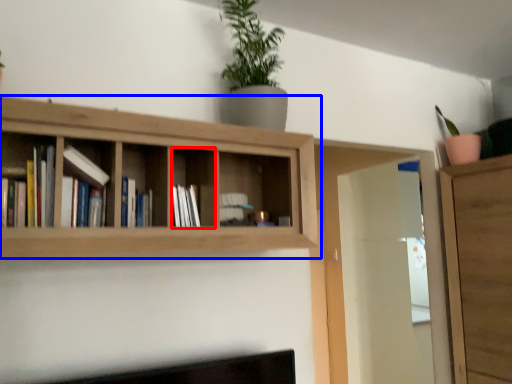
Question: Which point is closer to the camera, cabinet (highlighted by a red box) or shelf (highlighted by a blue box)?

Choices:
 (A) cabinet
 (B) shelf

Answer: (B)